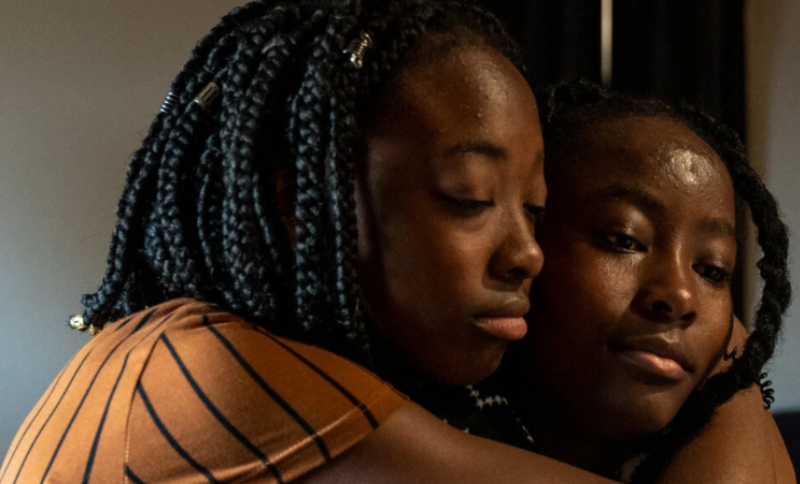
Where is `wall`? The width and height of the screenshot is (800, 484). wall is located at coordinates (82, 200).